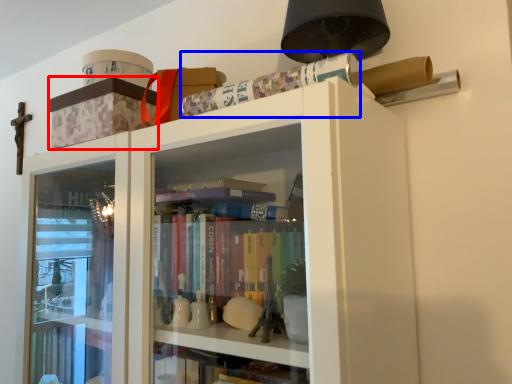
Question: Which object appears closest to the camera in this image, cabinetry (highlighted by a red box) or paperback book (highlighted by a blue box)?

Choices:
 (A) cabinetry
 (B) paperback book

Answer: (B)